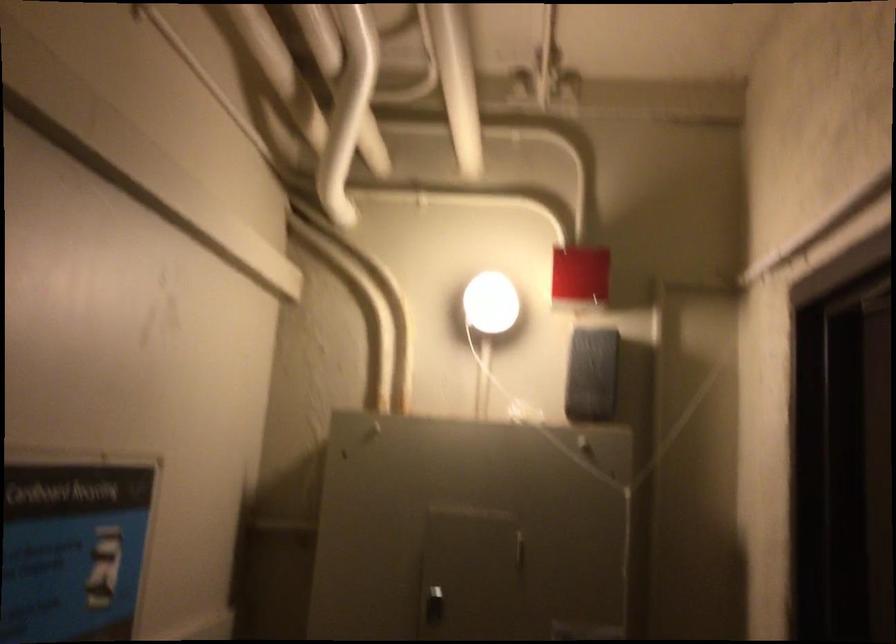
Find where to pull the metal panel latch. Please return your answer as a coordinate pair (x, y).

(448, 578)